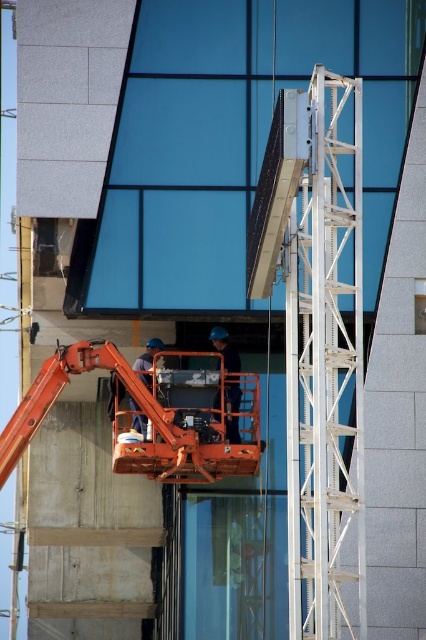
Based on the photo, does white metallic ladder at right appear over orange fabric construction worker at center?

Indeed, white metallic ladder at right is positioned over orange fabric construction worker at center.

Does white metallic ladder at right have a larger size compared to orange fabric construction worker at center?

Correct, white metallic ladder at right is larger in size than orange fabric construction worker at center.

At what (x,y) coordinates should I click in order to perform the action: click on white metallic ladder at right. Please return your answer as a coordinate pair (x, y). Looking at the image, I should click on (325, 372).